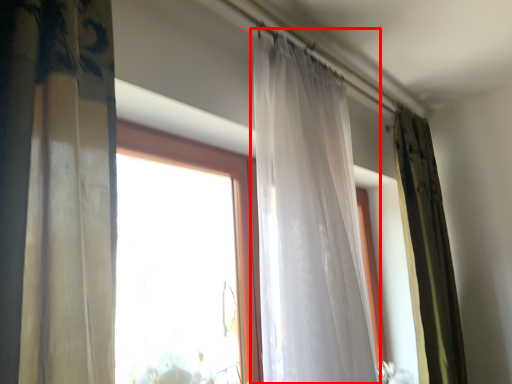
Question: From the image's perspective, what is the correct spatial relationship of curtain (annotated by the red box) in relation to curtain?

Choices:
 (A) below
 (B) above

Answer: (B)